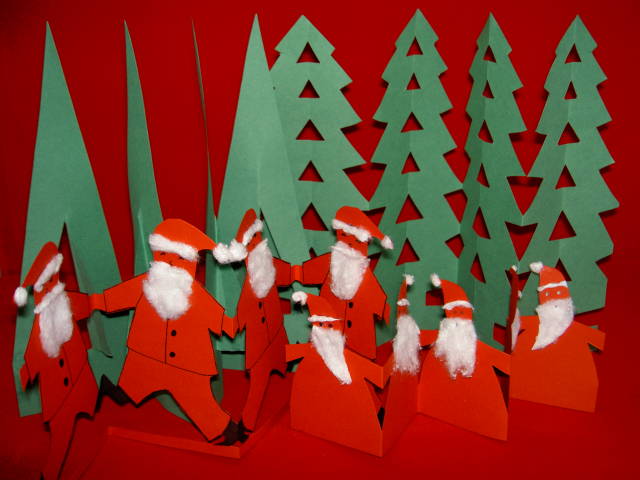
Identify the location of paper tree at far left. (59, 186).